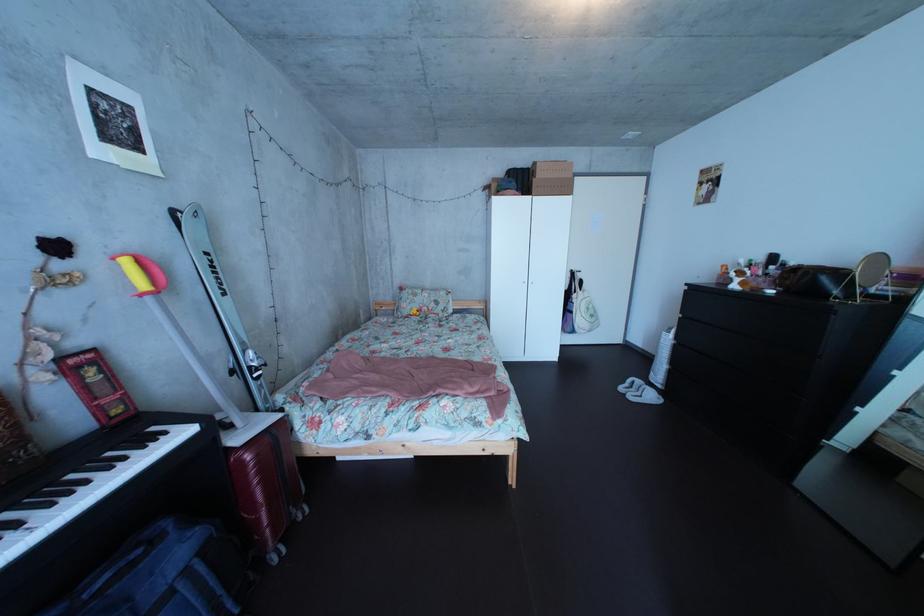
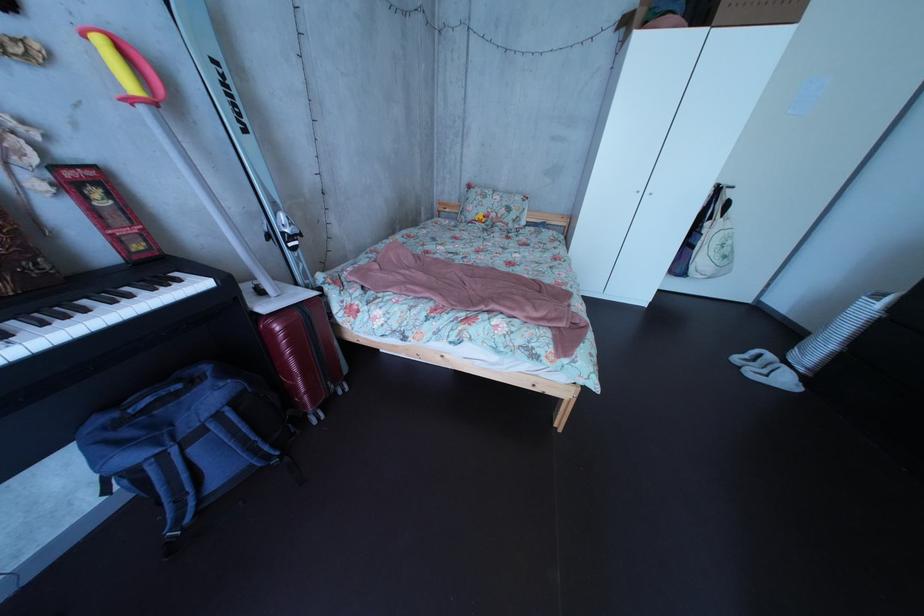
Find the pixel in the second image that matches (140,270) in the first image.

(116, 51)